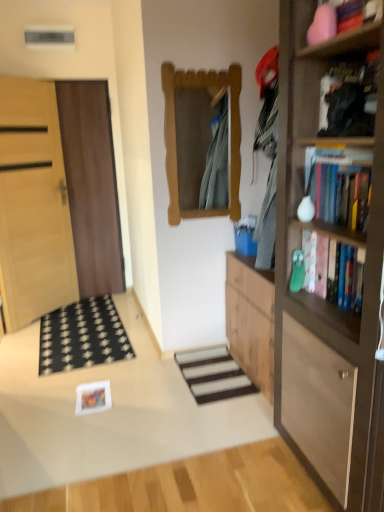
I want to click on vacant region above black matte bookshelf at upper right, placed as the 3th book when sorted from bottom to top (from a real-world perspective), so click(343, 72).